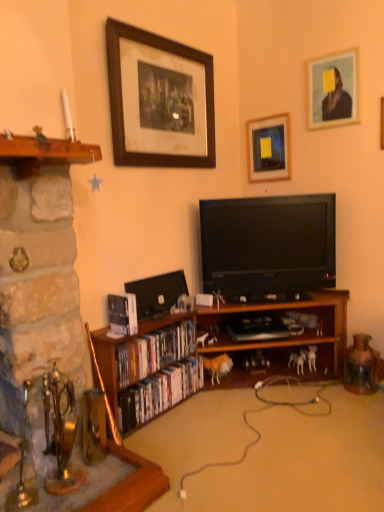
Locate an element on the screen. The height and width of the screenshot is (512, 384). vacant area located to the right-hand side of matte plastic dvds at lower left, marked as the third book in a top-to-bottom arrangement is located at coordinates (220, 417).